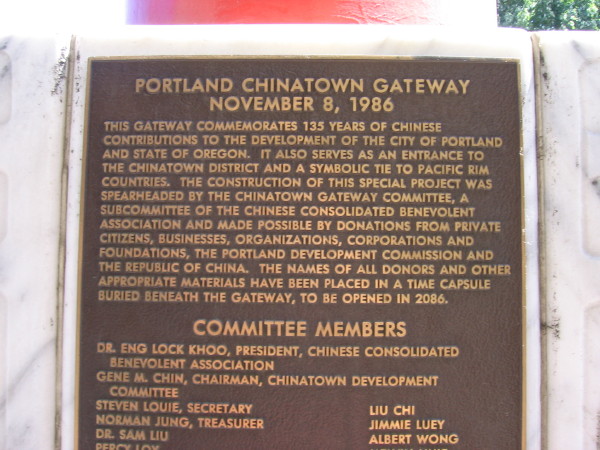
Where is `marble background`? This screenshot has height=450, width=600. marble background is located at coordinates (29, 137).